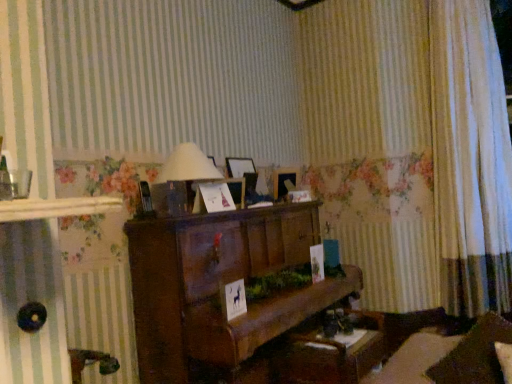
Question: From the image's perspective, is wooden piano at center located above or below matte white lampshade at center?

Choices:
 (A) above
 (B) below

Answer: (B)

Question: Considering the positions of wooden piano at center and matte white lampshade at center in the image, is wooden piano at center wider or thinner than matte white lampshade at center?

Choices:
 (A) thin
 (B) wide

Answer: (B)

Question: Based on their relative distances, which object is nearer to the wooden table at lower center?

Choices:
 (A) white sheer curtain at right
 (B) matte white lampshade at center
 (C) wooden piano at center

Answer: (C)

Question: Which object is the closest to the matte white lampshade at center?

Choices:
 (A) wooden piano at center
 (B) wooden table at lower center
 (C) white sheer curtain at right

Answer: (A)